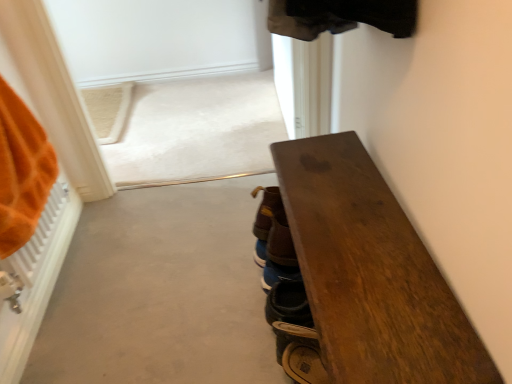
Question: Is brown suede shoes at center, the 3th footwear when ordered from front to back, shorter than brown leather shoes at center, which is the second footwear in front-to-back order?

Choices:
 (A) no
 (B) yes

Answer: (B)

Question: Is brown suede shoes at center, placed as the 1th footwear when sorted from back to front, to the right of brown leather shoes at center, the second footwear viewed from the back, from the viewer's perspective?

Choices:
 (A) no
 (B) yes

Answer: (A)

Question: Can you confirm if brown suede shoes at center, placed as the 1th footwear when sorted from back to front, is thinner than brown leather shoes at center, which is the second footwear in front-to-back order?

Choices:
 (A) no
 (B) yes

Answer: (B)

Question: Is brown leather shoes at center, the second footwear viewed from the back, completely or partially inside brown suede shoes at center, the 3th footwear when ordered from front to back?

Choices:
 (A) yes
 (B) no

Answer: (B)

Question: Does brown suede shoes at center, the 3th footwear when ordered from front to back, have a greater width compared to brown leather shoes at center, the second footwear viewed from the back?

Choices:
 (A) no
 (B) yes

Answer: (A)

Question: Is dark wood bench at right in front of or behind brown leather shoes at center, the second footwear viewed from the back, in the image?

Choices:
 (A) front
 (B) behind

Answer: (A)

Question: From the image's perspective, is dark wood bench at right above or below brown leather shoes at center, which is the second footwear in front-to-back order?

Choices:
 (A) below
 (B) above

Answer: (A)

Question: Is dark wood bench at right wider or thinner than brown leather shoes at center, the second footwear viewed from the back?

Choices:
 (A) wide
 (B) thin

Answer: (A)

Question: Visually, is dark wood bench at right positioned to the left or to the right of brown leather shoes at center, which is the second footwear in front-to-back order?

Choices:
 (A) right
 (B) left

Answer: (A)

Question: Is point (265, 201) closer or farther from the camera than point (352, 180)?

Choices:
 (A) closer
 (B) farther

Answer: (B)

Question: From the image's perspective, relative to dark wood bench at right, is brown leather shoes at center, which is the second footwear in front-to-back order, above or below?

Choices:
 (A) above
 (B) below

Answer: (A)

Question: In the image, is brown leather shoes at center, the second footwear viewed from the back, positioned in front of or behind dark wood bench at right?

Choices:
 (A) front
 (B) behind

Answer: (B)

Question: From a real-world perspective, is brown leather shoes at center, which is the second footwear in front-to-back order, positioned above or below dark wood bench at right?

Choices:
 (A) below
 (B) above

Answer: (B)

Question: Is point (364, 175) closer or farther from the camera than point (316, 344)?

Choices:
 (A) farther
 (B) closer

Answer: (A)

Question: In terms of width, does dark wood bench at right look wider or thinner when compared to leather brown shoe at lower center, positioned as the first footwear in front-to-back order?

Choices:
 (A) thin
 (B) wide

Answer: (B)